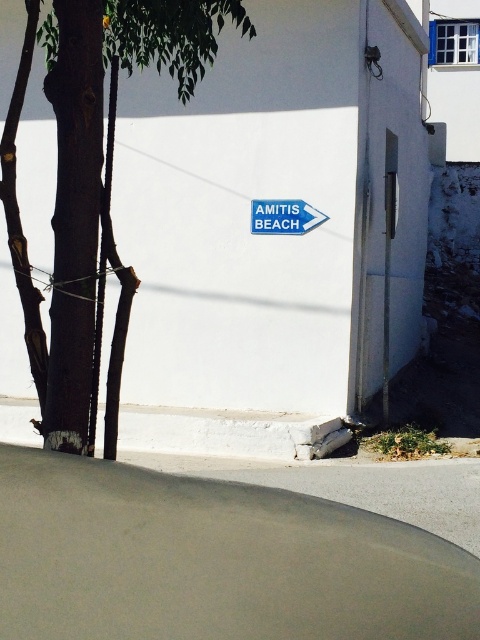
Question: Does brown rough bark at left appear on the left side of blue plastic sign at center?

Choices:
 (A) no
 (B) yes

Answer: (B)

Question: Does brown rough bark at left appear under blue plastic sign at center?

Choices:
 (A) yes
 (B) no

Answer: (A)

Question: Among these objects, which one is nearest to the camera?

Choices:
 (A) brown rough bark at left
 (B) blue plastic sign at center

Answer: (A)

Question: Which point is closer to the camera?

Choices:
 (A) blue plastic sign at center
 (B) brown rough bark at left

Answer: (B)

Question: Is brown rough bark at left positioned before blue plastic sign at center?

Choices:
 (A) no
 (B) yes

Answer: (B)